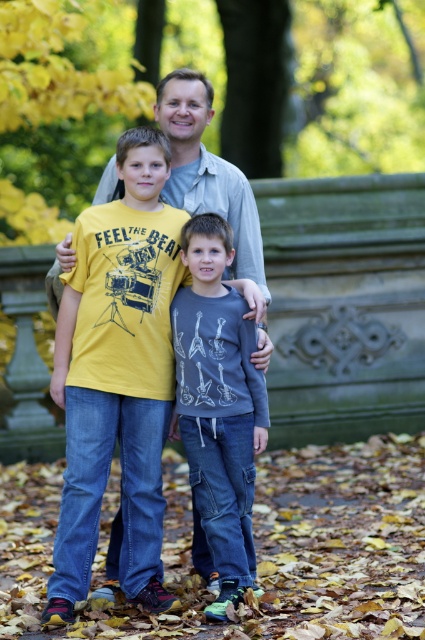
Between yellow cotton t-shirt at center and dark gray cotton shirt at center, which one is positioned higher?

yellow cotton t-shirt at center

Between point (65, 406) and point (206, 388), which one is positioned in front?

Point (206, 388) is in front.

Is point (150, 440) in front of point (180, 360)?

No, it is behind (180, 360).

Find the location of a particular element. yellow cotton t-shirt at center is located at coordinates (116, 378).